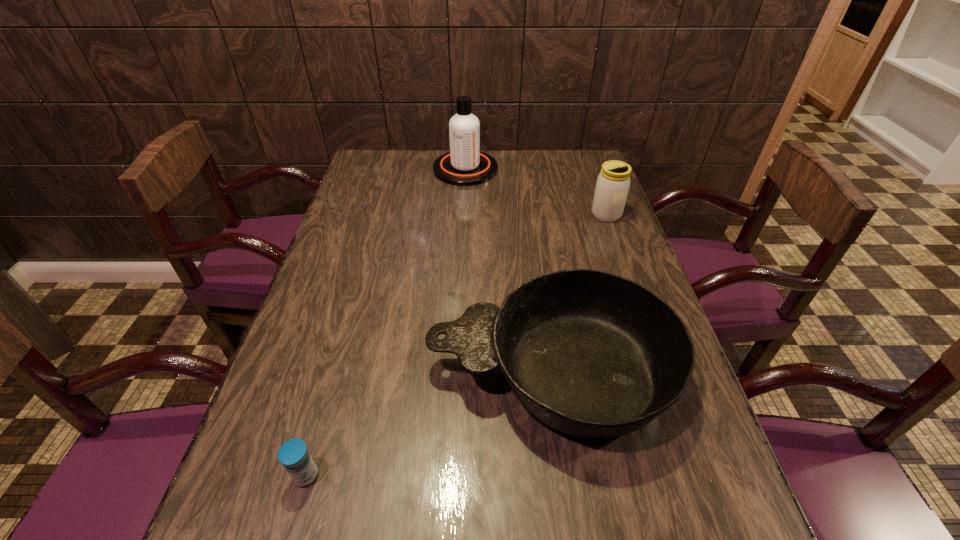
In the image, there is a desktop. Find the location of `vacant space at the right edge`. vacant space at the right edge is located at coordinates coord(710,443).

In the image, there is a desktop. Where is `free space at the far left corner`? free space at the far left corner is located at coordinates (390, 159).

Find the location of a particular element. The width and height of the screenshot is (960, 540). free space between the jar and the tallest object is located at coordinates (536, 192).

Locate an element on the screen. The width and height of the screenshot is (960, 540). vacant space that's between the frying pan and the shortest object is located at coordinates (428, 424).

At what (x,y) coordinates should I click in order to perform the action: click on free space between the farthest object and the frying pan. Please return your answer as a coordinate pair (x, y). This screenshot has width=960, height=540. Looking at the image, I should click on (508, 271).

The image size is (960, 540). I want to click on free space that is in between the leftmost object and the cleansing agent, so click(386, 322).

Image resolution: width=960 pixels, height=540 pixels. Identify the location of free spot between the tallest object and the second nearest object. (508, 271).

You are a GUI agent. You are given a task and a screenshot of the screen. Output one action in this format:
    pyautogui.click(x=<x>, y=<y>)
    Task: Click on the free space between the cleansing agent and the third tallest object
    The image size is (960, 540).
    Given the screenshot: What is the action you would take?
    coord(508,271)

This screenshot has width=960, height=540. Find the location of `vacant area that lies between the medicine and the cleansing agent`. vacant area that lies between the medicine and the cleansing agent is located at coordinates (386, 322).

The height and width of the screenshot is (540, 960). Find the location of `free space between the medicine and the tallest object`. free space between the medicine and the tallest object is located at coordinates (386, 322).